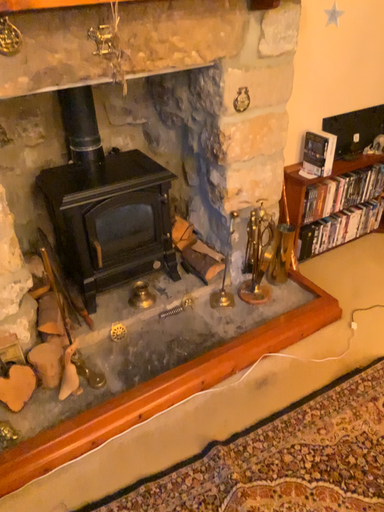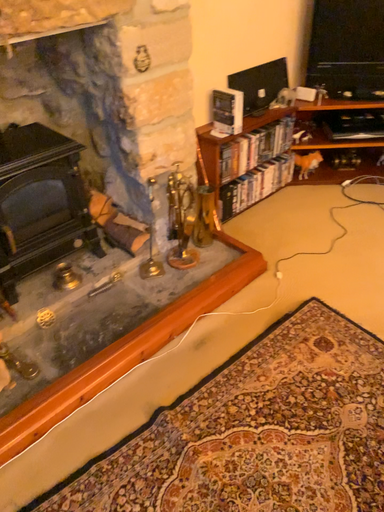
Question: Which way did the camera rotate in the video?

Choices:
 (A) rotated right
 (B) rotated left

Answer: (A)